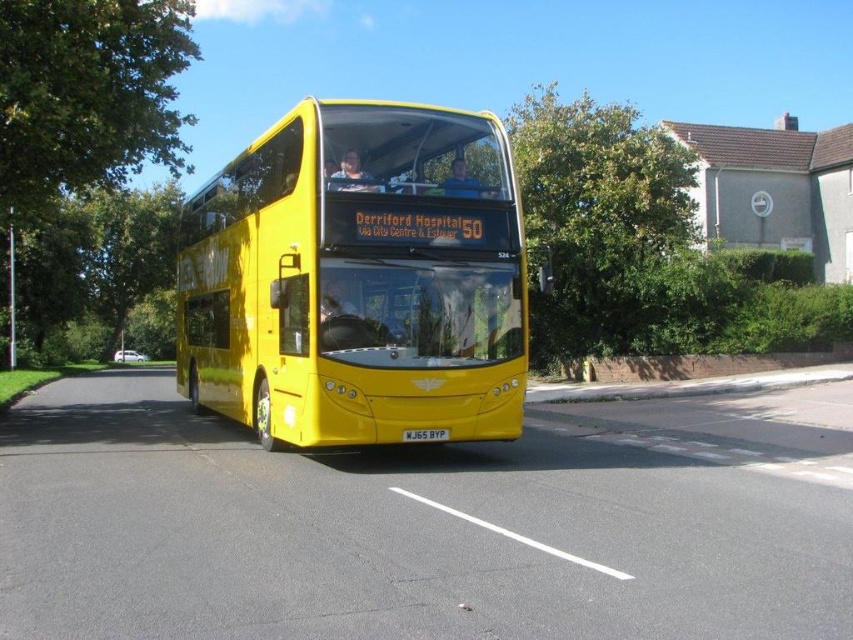
You are a passenger on the bright yellow double decker bus and you see two points on the road ahead. The first point is at coordinates point (41, 160) and the second is at point (440, 428). Which point is closer to you as you look forward from the bus?

Point (41, 160) is closer to you because it is further to the viewer than point (440, 428).